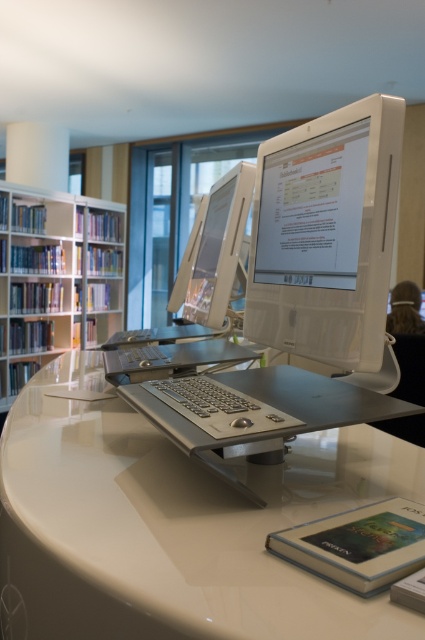
Locate an element on the screen. The height and width of the screenshot is (640, 425). white glossy bookshelf at left is located at coordinates (54, 278).

Which is more to the left, white glossy bookshelf at left or satin silver monitor at center?

white glossy bookshelf at left is more to the left.

Which is behind, point (11, 305) or point (186, 292)?

Point (11, 305)

Locate an element on the screen. white glossy bookshelf at left is located at coordinates (54, 278).

Can you confirm if white glossy computer desk at center is positioned below white glossy bookshelf at left?

Yes, white glossy computer desk at center is below white glossy bookshelf at left.

Is white glossy computer desk at center in front of white glossy bookshelf at left?

Yes, white glossy computer desk at center is in front of white glossy bookshelf at left.

The height and width of the screenshot is (640, 425). Describe the element at coordinates (172, 525) in the screenshot. I see `white glossy computer desk at center` at that location.

Locate an element on the screen. white glossy computer desk at center is located at coordinates (172, 525).

Can you confirm if white glossy computer desk at center is smaller than white glossy monitor at center?

Incorrect, white glossy computer desk at center is not smaller in size than white glossy monitor at center.

Is point (13, 611) more distant than point (292, 256)?

No, (13, 611) is in front of (292, 256).

I want to click on white glossy computer desk at center, so click(172, 525).